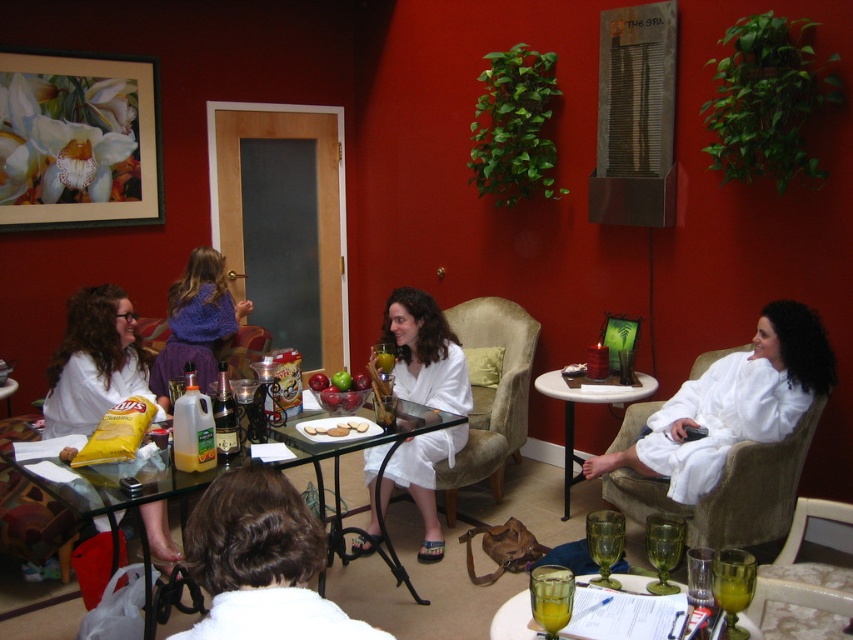
You are a guest at the spa and want to reach for the smooth chocolate bar at center from the translucent glass table at lower center. Can you comfortably grab it without moving your chair?

The distance between the translucent glass table at lower center and the smooth chocolate bar at center is 1.01 meters. Since this distance is slightly over a meter, it might be a bit of a stretch to reach comfortably without moving your chair. It would be advisable to adjust your position for better access.

You are a guest in the spa and want to place your phone on the yellow matte bag of chips at lower left. However, you are sitting in the beige fabric armchair at center. Can you reach the bag of chips without moving from your seat?

The yellow matte bag of chips at lower left is shorter than the beige fabric armchair at center. Since the bag is shorter, it might be difficult to reach from the armchair unless you lean forward, but you cannot be certain without knowing the exact distance between them.

You are a delivery person who needs to place a rectangular box that is 1.2 meters wide on the table. The table has the yellow matte bag of chips at lower left and the beige fabric armchair at center nearby. Can you place the box between these two items without moving them?

The yellow matte bag of chips at lower left might be wider than beige fabric armchair at center, so the distance between them is uncertain. Without knowing the exact space, it is risky to place the 1.2 meter wide box between them. Better to check the actual distance first.